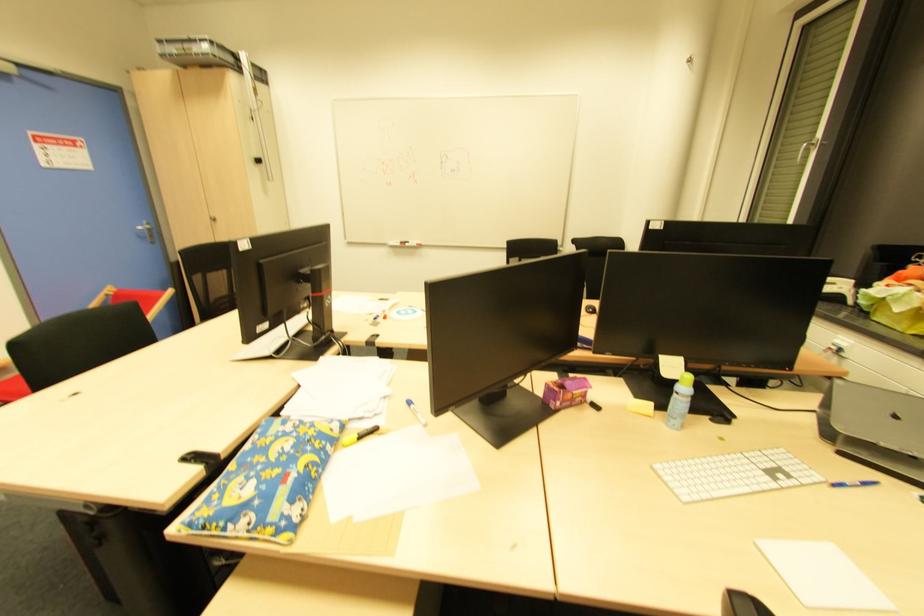
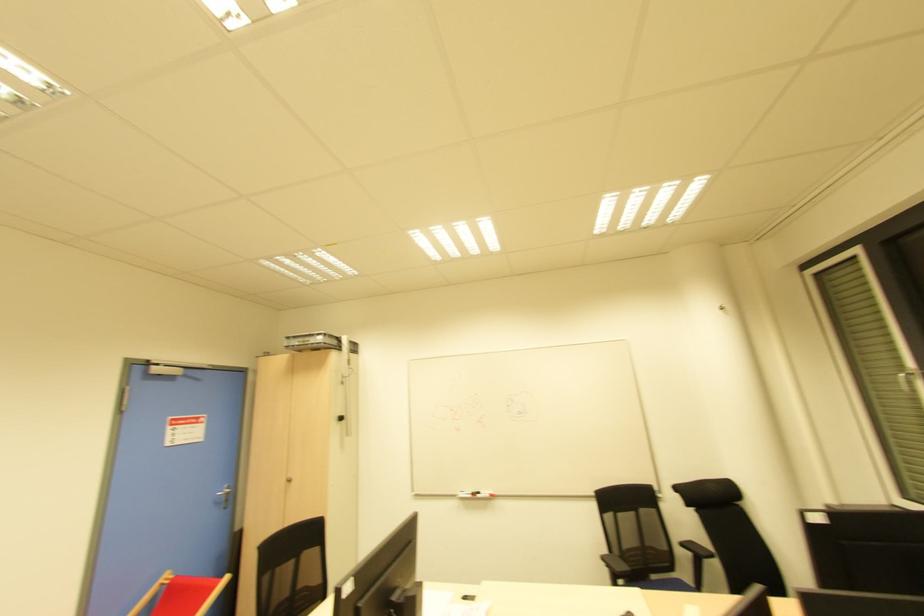
In the second image, find the point that corresponds to (x=419, y=246) in the first image.

(492, 496)